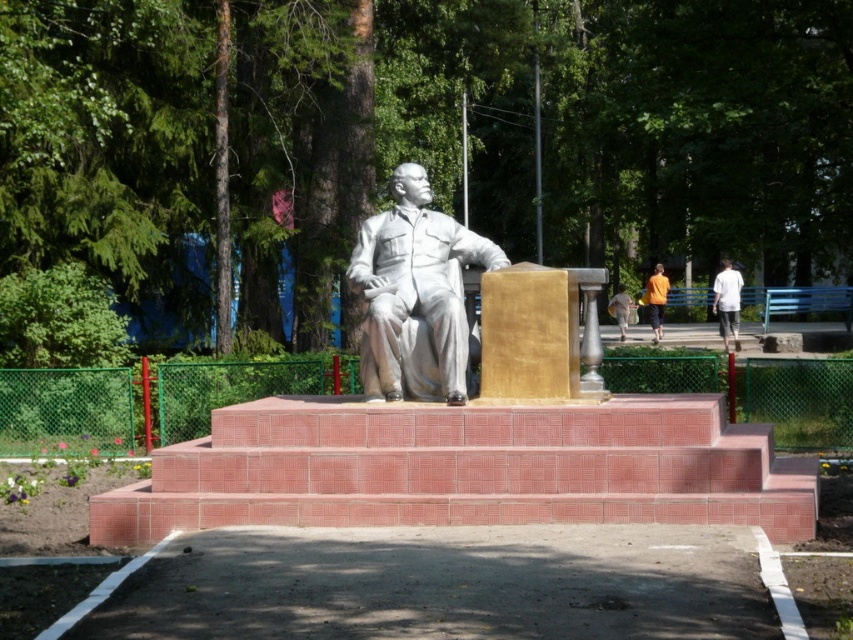
Question: Does red brick stairs at center have a larger size compared to white cotton shirt at upper right?

Choices:
 (A) yes
 (B) no

Answer: (B)

Question: Which of the following is the farthest from the observer?

Choices:
 (A) (376, 248)
 (B) (659, 324)

Answer: (B)

Question: Is white cotton shirt at upper right below orange fabric shirt at right?

Choices:
 (A) yes
 (B) no

Answer: (A)

Question: Based on their relative distances, which object is nearer to the white marble statue at center?

Choices:
 (A) yellow shirt at center
 (B) white cotton shirt at upper right
 (C) orange fabric shirt at right
 (D) red brick stairs at center

Answer: (D)

Question: Which object is the closest to the white marble statue at center?

Choices:
 (A) orange fabric shirt at right
 (B) yellow shirt at center
 (C) white cotton shirt at upper right
 (D) red brick stairs at center

Answer: (D)

Question: Is red brick stairs at center closer to camera compared to white cotton shirt at upper right?

Choices:
 (A) yes
 (B) no

Answer: (A)